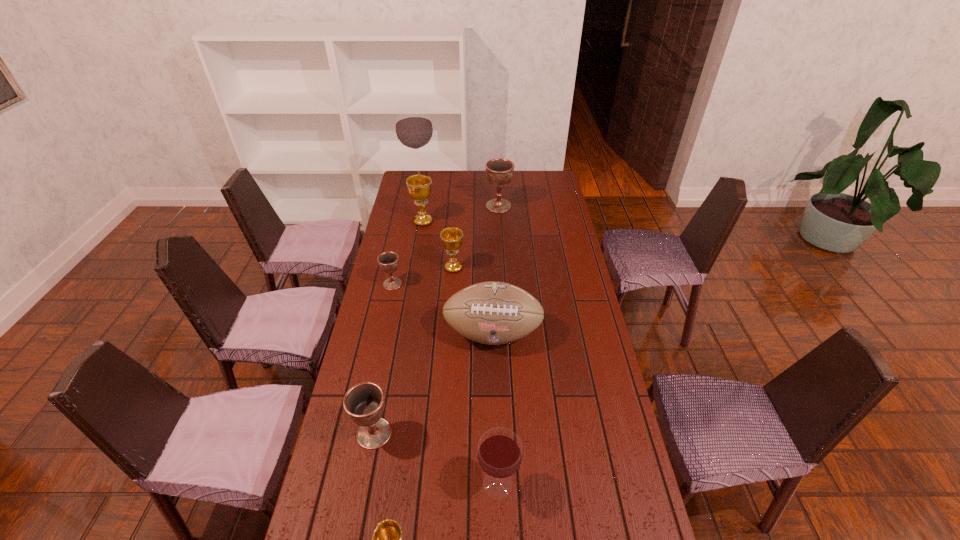
The height and width of the screenshot is (540, 960). What are the coordinates of `free space at the far right corner` in the screenshot? It's located at (558, 178).

Locate an element on the screen. This screenshot has width=960, height=540. vacant area that lies between the sixth farthest object and the second nearest object is located at coordinates (495, 409).

In order to click on vacant area that lies between the rightmost gold chalice and the seventh farthest object in this screenshot , I will do `click(414, 350)`.

Image resolution: width=960 pixels, height=540 pixels. In order to click on empty space between the farthest brown chalice and the red alcohol in this screenshot , I will do `click(459, 194)`.

Select which object is the eighth closest to the fifth nearest object. Please provide its 2D coordinates. Your answer should be formatted as a tuple, i.e. [(x, y)], where the tuple contains the x and y coordinates of a point satisfying the conditions above.

[(387, 539)]

This screenshot has width=960, height=540. I want to click on object that is the fourth closest one to the smallest brown chalice, so click(364, 403).

Point out which chalice is positioned as the fifth nearest to the fourth farthest object. Please provide its 2D coordinates. Your answer should be formatted as a tuple, i.e. [(x, y)], where the tuple contains the x and y coordinates of a point satisfying the conditions above.

[(387, 539)]

Find the location of `the fifth closest chalice to the fourth nearest object`. the fifth closest chalice to the fourth nearest object is located at coordinates (387, 539).

Identify the location of the second closest brown chalice to the second nearest brown chalice. The width and height of the screenshot is (960, 540). (499, 172).

Find the location of a particular element. Image resolution: width=960 pixels, height=540 pixels. brown chalice that is the closest to the smallest brown chalice is located at coordinates (364, 403).